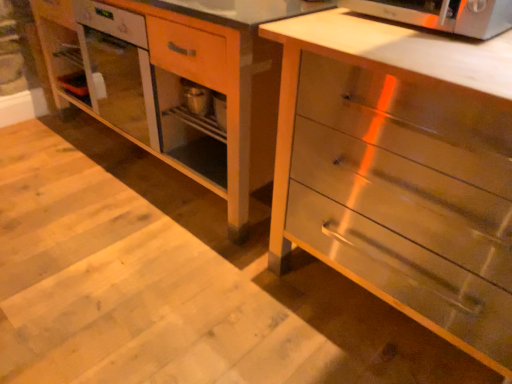
Question: Should I look upward or downward to see satin silver microwave oven at upper right?

Choices:
 (A) up
 (B) down

Answer: (A)

Question: Is metallic silver chest of drawers at center positioned in front of satin silver microwave oven at upper right?

Choices:
 (A) yes
 (B) no

Answer: (A)

Question: Can you confirm if metallic silver chest of drawers at center is thinner than satin silver microwave oven at upper right?

Choices:
 (A) yes
 (B) no

Answer: (B)

Question: From a real-world perspective, is metallic silver chest of drawers at center beneath satin silver microwave oven at upper right?

Choices:
 (A) no
 (B) yes

Answer: (B)

Question: Does metallic silver chest of drawers at center have a larger size compared to satin silver microwave oven at upper right?

Choices:
 (A) yes
 (B) no

Answer: (A)

Question: Is metallic silver chest of drawers at center oriented away from satin silver microwave oven at upper right?

Choices:
 (A) yes
 (B) no

Answer: (B)

Question: Is metallic silver chest of drawers at center next to satin silver microwave oven at upper right and touching it?

Choices:
 (A) yes
 (B) no

Answer: (B)

Question: Is metallic silver chest of drawers at center oriented away from wooden vanity at center?

Choices:
 (A) no
 (B) yes

Answer: (A)

Question: Does metallic silver chest of drawers at center have a greater width compared to wooden vanity at center?

Choices:
 (A) yes
 (B) no

Answer: (B)

Question: From a real-world perspective, does metallic silver chest of drawers at center sit lower than wooden vanity at center?

Choices:
 (A) no
 (B) yes

Answer: (B)

Question: Is the position of metallic silver chest of drawers at center less distant than that of wooden vanity at center?

Choices:
 (A) no
 (B) yes

Answer: (B)

Question: Considering the relative sizes of metallic silver chest of drawers at center and wooden vanity at center in the image provided, is metallic silver chest of drawers at center smaller than wooden vanity at center?

Choices:
 (A) yes
 (B) no

Answer: (A)

Question: Is metallic silver chest of drawers at center not close to wooden vanity at center?

Choices:
 (A) no
 (B) yes

Answer: (A)

Question: From a real-world perspective, is wooden vanity at center located beneath satin silver microwave oven at upper right?

Choices:
 (A) yes
 (B) no

Answer: (A)